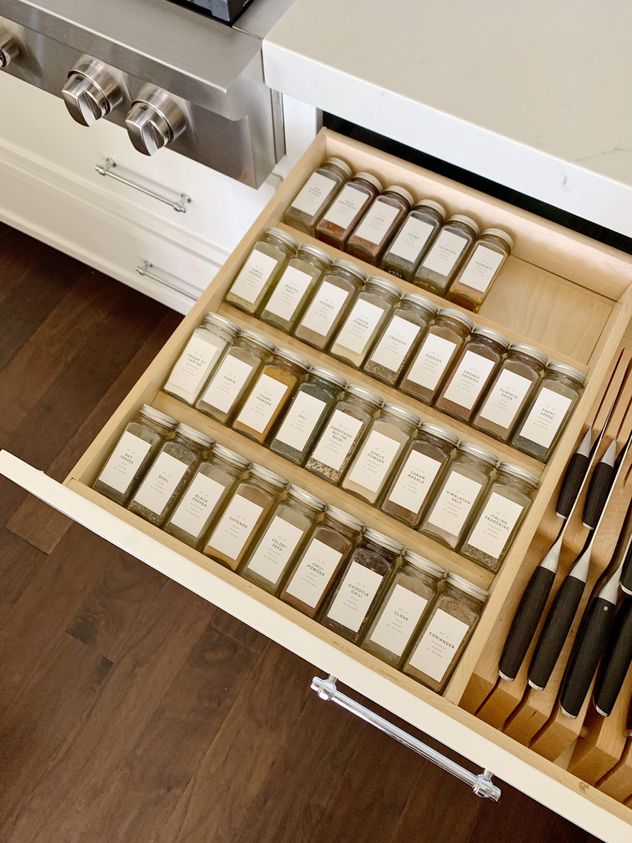
You are a GUI agent. You are given a task and a screenshot of the screen. Output one action in this format:
    pyautogui.click(x=<x>, y=<y>)
    Task: Click on the wood floor
    The image size is (632, 843).
    Given the screenshot: What is the action you would take?
    [x=234, y=776]